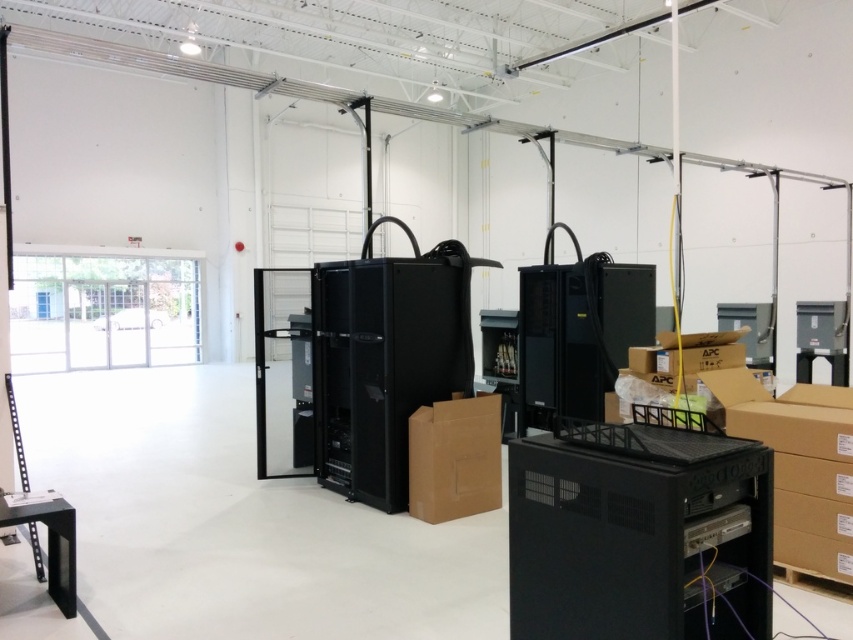
You are an IT technician who needs to install a new server. You have a black plastic server at center and a black matte server at center in front of you. Which server can you fit into a space that is only 1 meter wide?

The black plastic server at center has a lesser width compared to the black matte server at center, so it can fit into the 1 meter wide space.

You are an IT technician tasked with installing a new rack that requires 2 meters of vertical space. You see the black plastic server at center and the black matte server at center. Which server can accommodate the new rack based on their heights?

The black matte server at center is taller than the black plastic server at center, so the new rack requiring 2 meters of vertical space can be installed on the black matte server at center if its height meets or exceeds the requirement.